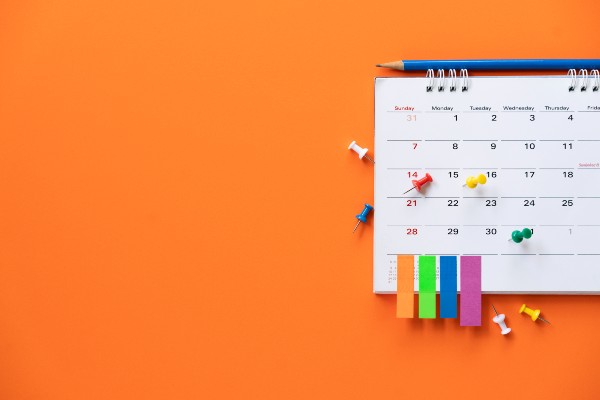
I want to click on sticky notes, so click(404, 293), click(421, 293), click(446, 293), click(472, 293).